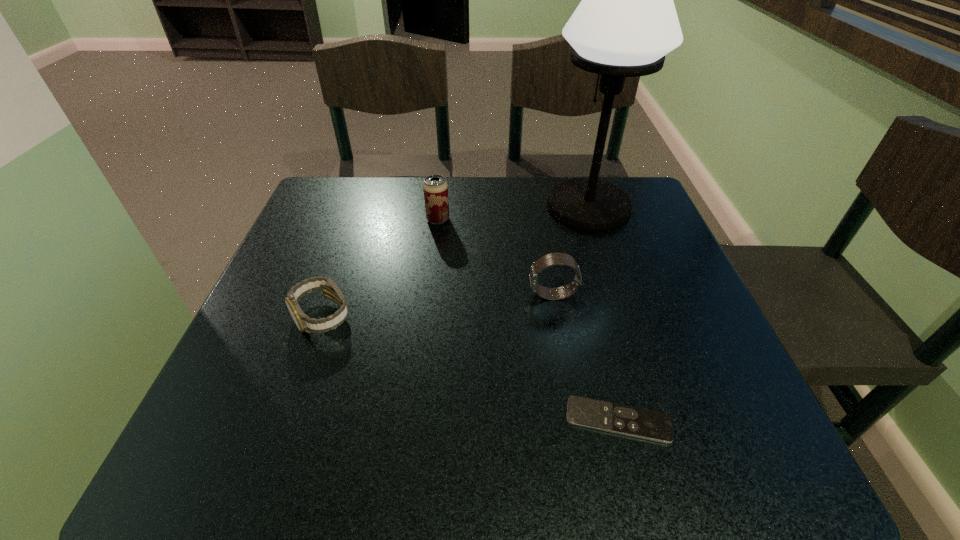
At what (x,y) coordinates should I click in order to perform the action: click on empty space between the fourth object from right to left and the table lamp. Please return your answer as a coordinate pair (x, y). Looking at the image, I should click on (513, 213).

Locate an element on the screen. empty space between the leftmost object and the beer can is located at coordinates (380, 268).

Identify the location of free space between the tallest object and the second shortest object. This screenshot has width=960, height=540. (455, 261).

I want to click on vacant space that's between the nearest object and the taller watch, so click(x=586, y=357).

You are a GUI agent. You are given a task and a screenshot of the screen. Output one action in this format:
    pyautogui.click(x=<x>, y=<y>)
    Task: Click on the vacant region between the table lamp and the shorter watch
    
    Given the screenshot: What is the action you would take?
    pyautogui.click(x=455, y=261)

Image resolution: width=960 pixels, height=540 pixels. Identify the location of free space between the second shortest object and the shortest object. pyautogui.click(x=470, y=368).

Locate an element on the screen. free space between the right watch and the beer can is located at coordinates (495, 257).

The image size is (960, 540). Find the location of `vacant point located between the left watch and the remote control`. vacant point located between the left watch and the remote control is located at coordinates (470, 368).

Locate which object ranks third in proximity to the fourth object from right to left. Please provide its 2D coordinates. Your answer should be formatted as a tuple, i.e. [(x, y)], where the tuple contains the x and y coordinates of a point satisfying the conditions above.

[(551, 259)]

Locate which object ranks fourth in proximity to the table lamp. Please provide its 2D coordinates. Your answer should be formatted as a tuple, i.e. [(x, y)], where the tuple contains the x and y coordinates of a point satisfying the conditions above.

[(330, 290)]